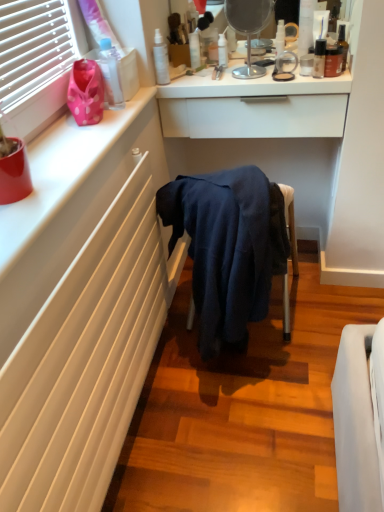
Find the location of `free space in front of translucent plastic spray bottle at upper center, marked as the fifth toiletry in a right-to-left arrangement`. free space in front of translucent plastic spray bottle at upper center, marked as the fifth toiletry in a right-to-left arrangement is located at coordinates 233,77.